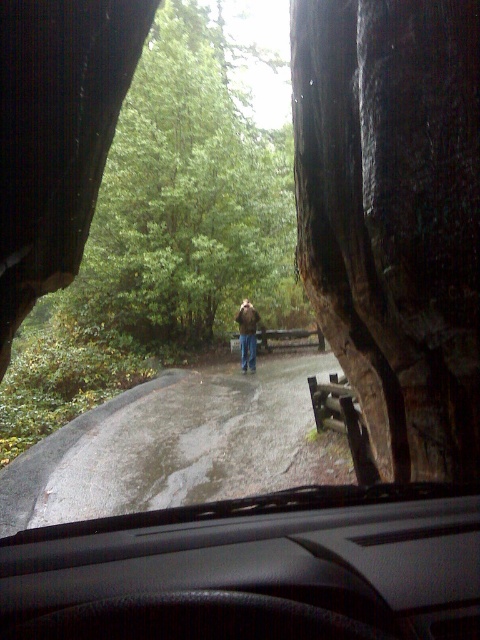
Can you confirm if green leafy tree at center is thinner than brown leather jacket at center?

No, green leafy tree at center is not thinner than brown leather jacket at center.

Between green leafy tree at center and brown leather jacket at center, which one appears on the left side from the viewer's perspective?

From the viewer's perspective, green leafy tree at center appears more on the left side.

Image resolution: width=480 pixels, height=640 pixels. I want to click on green leafy tree at center, so click(x=183, y=198).